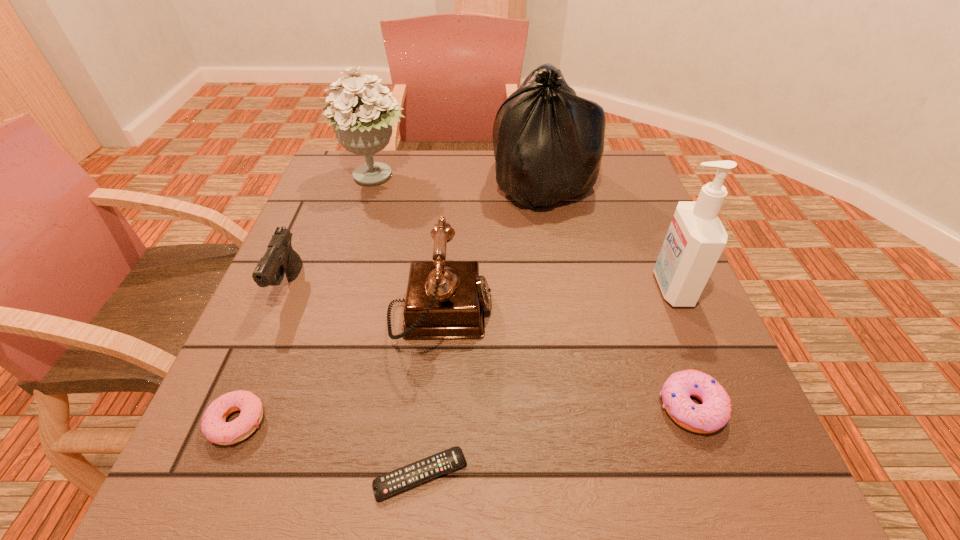
Point out which object is positioned as the sixth nearest to the remote control. Please provide its 2D coordinates. Your answer should be formatted as a tuple, i.e. [(x, y)], where the tuple contains the x and y coordinates of a point satisfying the conditions above.

[(548, 142)]

Locate an element on the screen. free space that satisfies the following two spatial constraints: 1. on the front side of the plastic bag; 2. on the right side of the bouquet is located at coordinates (374, 183).

Where is `blank space that satisfies the following two spatial constraints: 1. on the front side of the plastic bag; 2. on the dial of the telephone`? The height and width of the screenshot is (540, 960). blank space that satisfies the following two spatial constraints: 1. on the front side of the plastic bag; 2. on the dial of the telephone is located at coordinates 565,315.